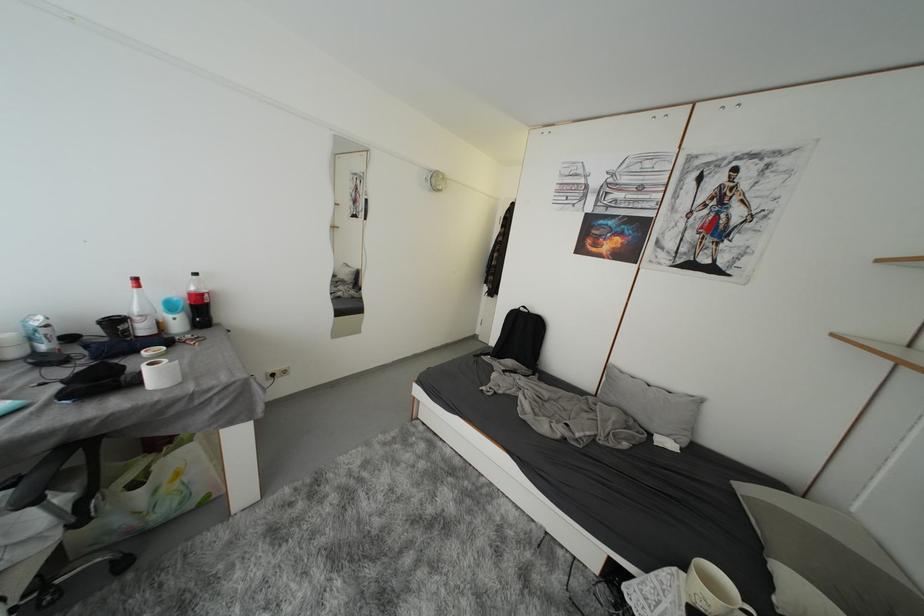
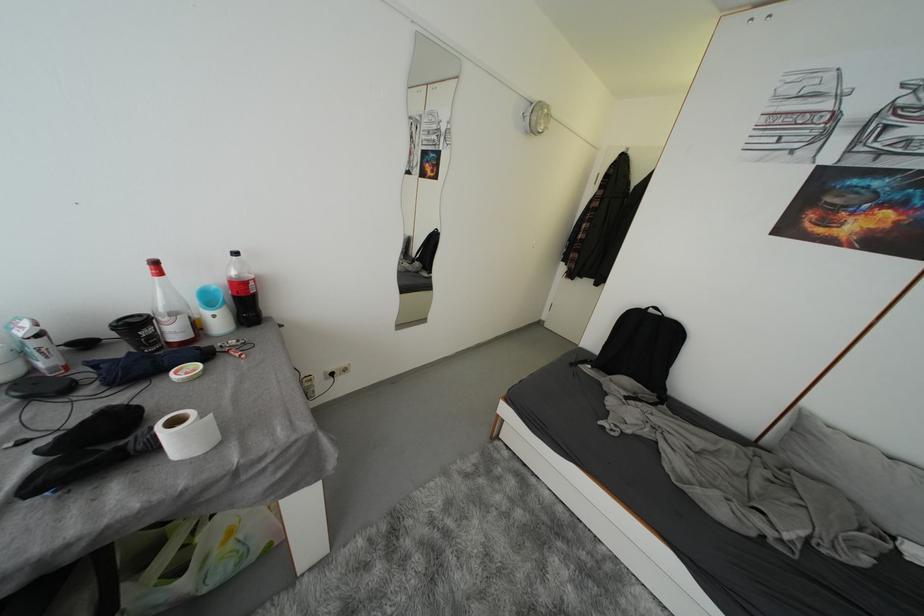
Locate, in the second image, the point that corresponds to [177,365] in the first image.

(208, 419)